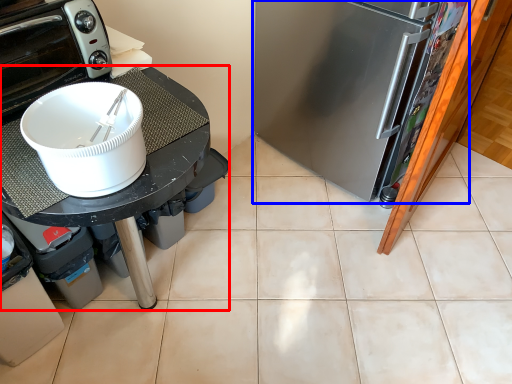
Question: Which object appears farthest to the camera in this image, table (highlighted by a red box) or refrigerator (highlighted by a blue box)?

Choices:
 (A) table
 (B) refrigerator

Answer: (B)